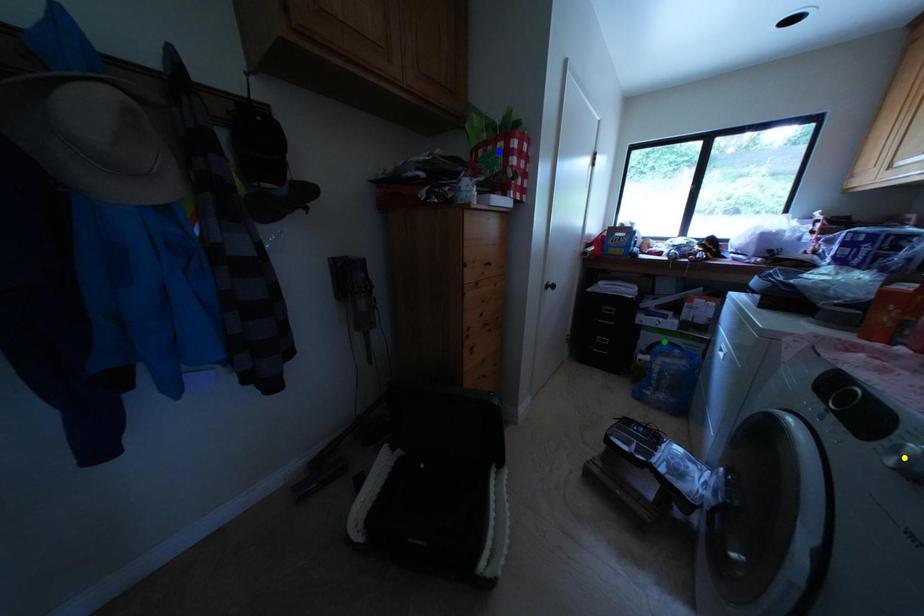
In the scene shown: Order these from nearest to farthest:
- green point
- blue point
- yellow point

yellow point → blue point → green point